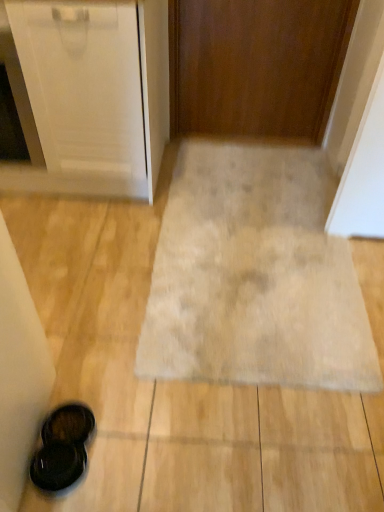
Question: Is beige carpet at center at the left side of black matte sandals at lower left?

Choices:
 (A) yes
 (B) no

Answer: (B)

Question: From a real-world perspective, does beige carpet at center sit lower than black matte sandals at lower left?

Choices:
 (A) yes
 (B) no

Answer: (A)

Question: From the image's perspective, is beige carpet at center located above black matte sandals at lower left?

Choices:
 (A) no
 (B) yes

Answer: (B)

Question: Can you confirm if beige carpet at center is thinner than black matte sandals at lower left?

Choices:
 (A) yes
 (B) no

Answer: (B)

Question: Is the depth of beige carpet at center greater than that of black matte sandals at lower left?

Choices:
 (A) no
 (B) yes

Answer: (B)

Question: From a real-world perspective, is beige carpet at center located higher than black matte sandals at lower left?

Choices:
 (A) no
 (B) yes

Answer: (A)

Question: Could wooden door at center be considered to be inside beige carpet at center?

Choices:
 (A) yes
 (B) no

Answer: (B)

Question: Is beige carpet at center beside wooden door at center?

Choices:
 (A) yes
 (B) no

Answer: (B)

Question: Is beige carpet at center in front of wooden door at center?

Choices:
 (A) yes
 (B) no

Answer: (A)

Question: Is beige carpet at center positioned far away from wooden door at center?

Choices:
 (A) yes
 (B) no

Answer: (B)

Question: Can you confirm if beige carpet at center is smaller than wooden door at center?

Choices:
 (A) no
 (B) yes

Answer: (B)

Question: Is wooden door at center at the back of beige carpet at center?

Choices:
 (A) yes
 (B) no

Answer: (B)

Question: Does wooden door at center have a lesser height compared to black matte sandals at lower left?

Choices:
 (A) no
 (B) yes

Answer: (A)